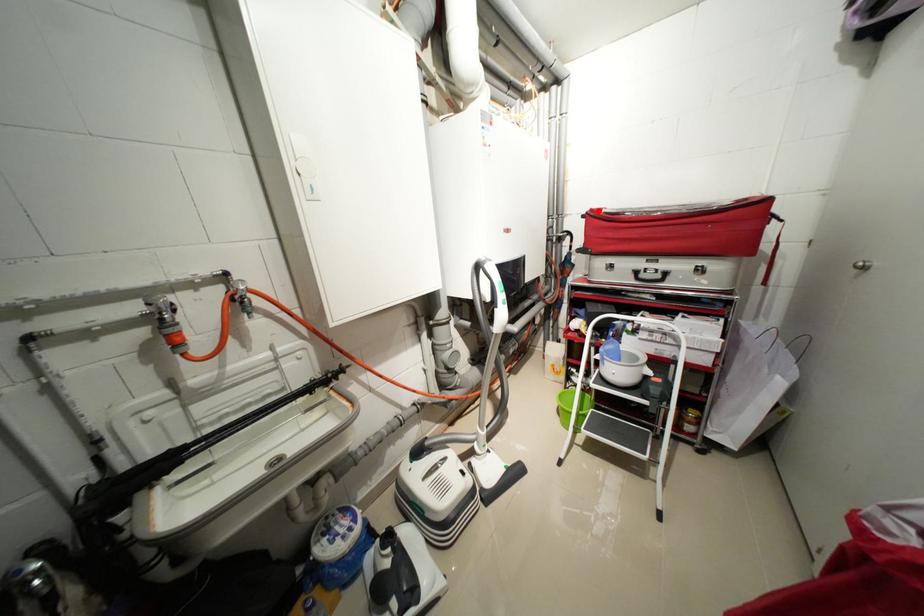
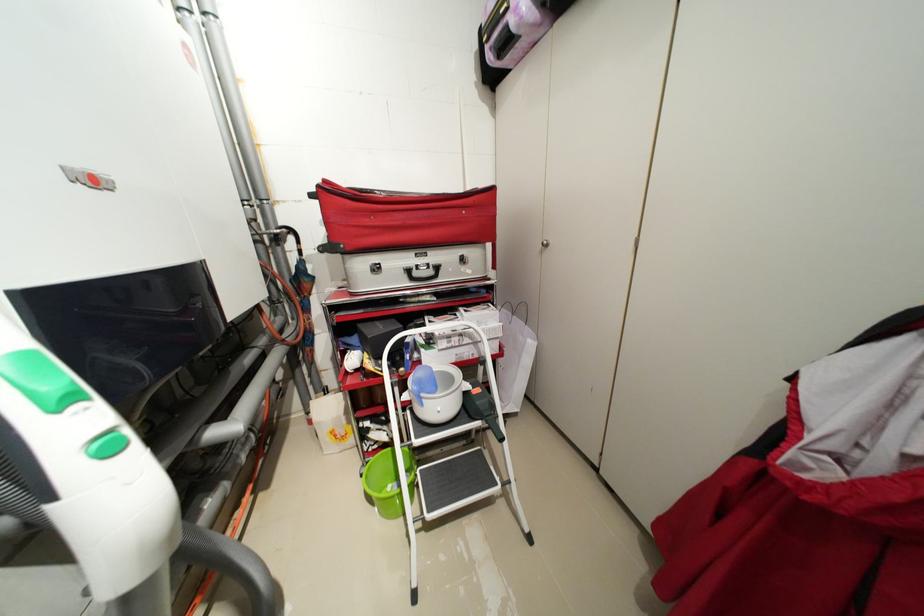
The point at the highlighted location is marked in the first image. Where is the corresponding point in the second image?

(332, 182)